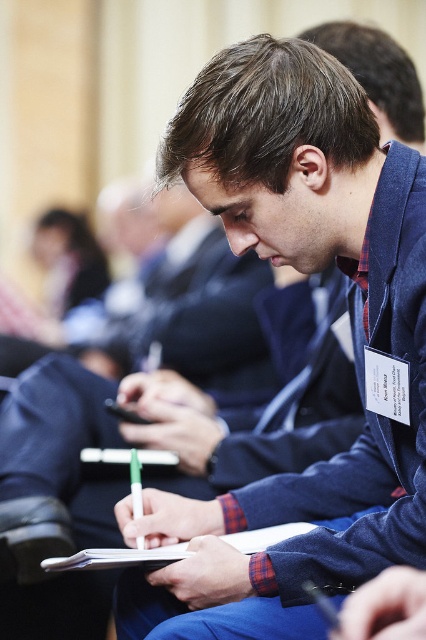
Question: Which of the following is the closest to the observer?

Choices:
 (A) white paper clipboard at center
 (B) blue fabric jacket at center

Answer: (B)

Question: Can you confirm if blue fabric jacket at center is positioned to the left of white paper clipboard at center?

Choices:
 (A) yes
 (B) no

Answer: (B)

Question: Does blue fabric jacket at center have a larger size compared to white paper clipboard at center?

Choices:
 (A) yes
 (B) no

Answer: (A)

Question: Which point is farther to the camera?

Choices:
 (A) (394, 268)
 (B) (293, 522)

Answer: (B)

Question: Is blue fabric jacket at center to the right of white paper clipboard at center from the viewer's perspective?

Choices:
 (A) yes
 (B) no

Answer: (A)